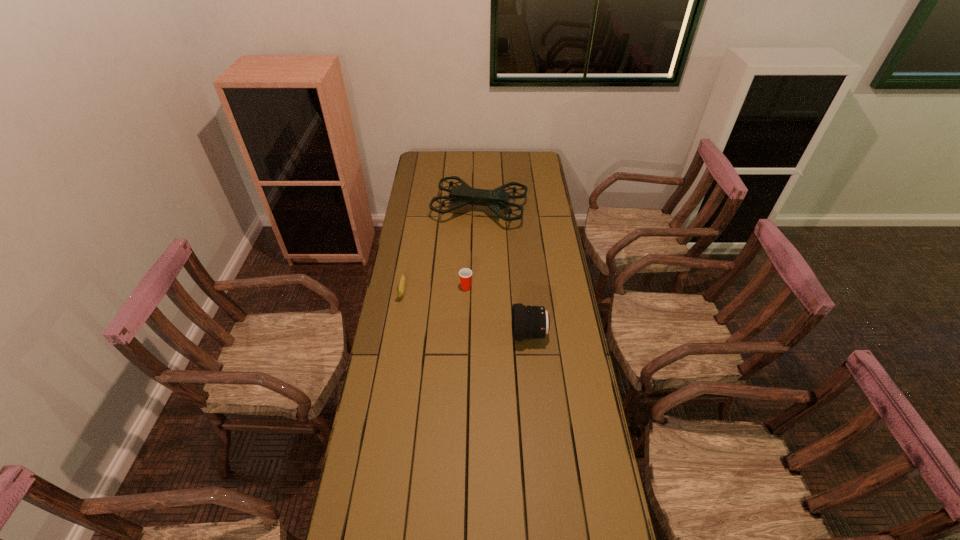
Locate an element on the screen. The width and height of the screenshot is (960, 540). vacant space that is in between the farthest object and the leftmost object is located at coordinates (441, 249).

In order to click on free space between the leftmost object and the telephoto lens in this screenshot , I will do `click(466, 312)`.

Find the location of a particular element. This screenshot has width=960, height=540. vacant point located between the Dixie cup and the tallest object is located at coordinates (472, 248).

In order to click on free space between the farthest object and the third shortest object in this screenshot , I will do click(x=504, y=272).

Identify the location of unoccupied position between the Dixie cup and the second tallest object. This screenshot has width=960, height=540. (497, 310).

At what (x,y) coordinates should I click in order to perform the action: click on empty space between the Dixie cup and the farthest object. Please return your answer as a coordinate pair (x, y). The height and width of the screenshot is (540, 960). Looking at the image, I should click on (472, 248).

I want to click on vacant space in between the Dixie cup and the farthest object, so click(x=472, y=248).

Image resolution: width=960 pixels, height=540 pixels. What are the coordinates of `vacant space that's between the banana and the Dixie cup` in the screenshot? It's located at (434, 288).

The width and height of the screenshot is (960, 540). Find the location of `free space between the farthest object and the banana`. free space between the farthest object and the banana is located at coordinates tap(441, 249).

Identify the location of object that is the third nearest to the leftmost object. The width and height of the screenshot is (960, 540). (x=528, y=322).